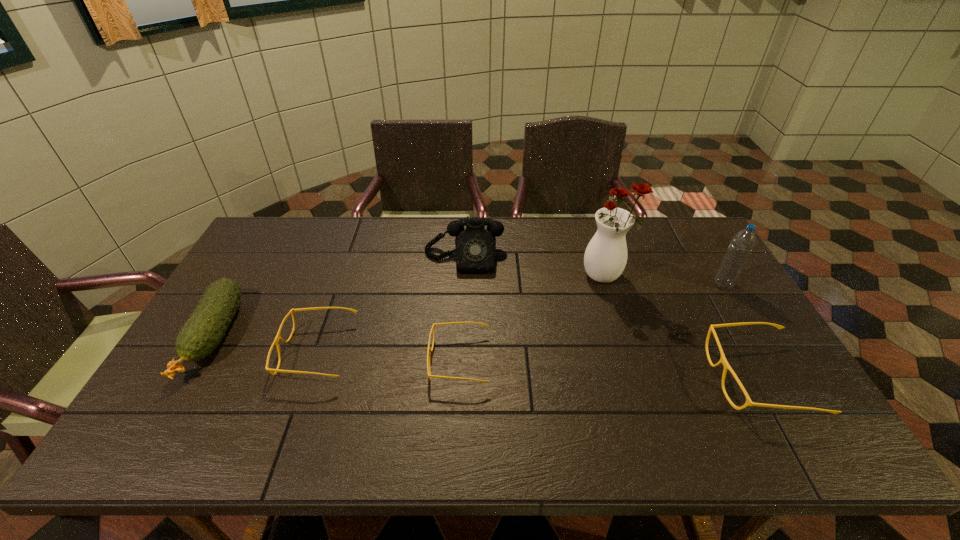
I want to click on vacant space located 0.070m on the dial of the telephone, so click(463, 290).

You are a GUI agent. You are given a task and a screenshot of the screen. Output one action in this format:
    pyautogui.click(x=<x>, y=<y>)
    Task: Click on the vacant area located 0.180m on the right of the vase
    This screenshot has height=540, width=960.
    Given the screenshot: What is the action you would take?
    pos(682,275)

I want to click on blank space located on the front of the sixth shortest object, so click(745, 320).

The width and height of the screenshot is (960, 540). In order to click on object present at the far edge in this screenshot , I will do `click(475, 247)`.

This screenshot has height=540, width=960. I want to click on cucumber present at the near edge, so click(203, 331).

Identify the location of object located in the left edge section of the desktop. (203, 331).

Identify the location of spectacles that is at the right edge. 722,360.

At what (x,y) coordinates should I click in order to perform the action: click on water bottle located in the right edge section of the desktop. Please return your answer as a coordinate pair (x, y). The image size is (960, 540). Looking at the image, I should click on (744, 241).

At what (x,y) coordinates should I click in order to perform the action: click on object situated at the near left corner. Please return your answer as a coordinate pair (x, y). Looking at the image, I should click on (203, 331).

The width and height of the screenshot is (960, 540). Identify the location of object that is at the near right corner. (722, 360).